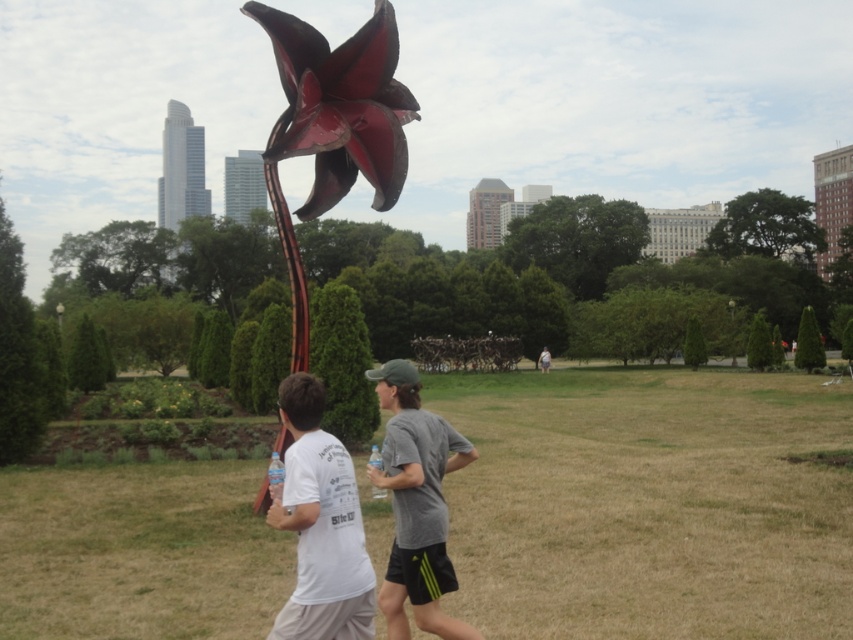
You are a photographer trying to capture the white matte t shirt at center. The camera you are using has a focal point at point (320, 525). Will the white matte t shirt at center be in focus?

The white matte t shirt at center is located at point (320, 525), so yes, the white matte t shirt at center will be in focus because the focal point matches its location.